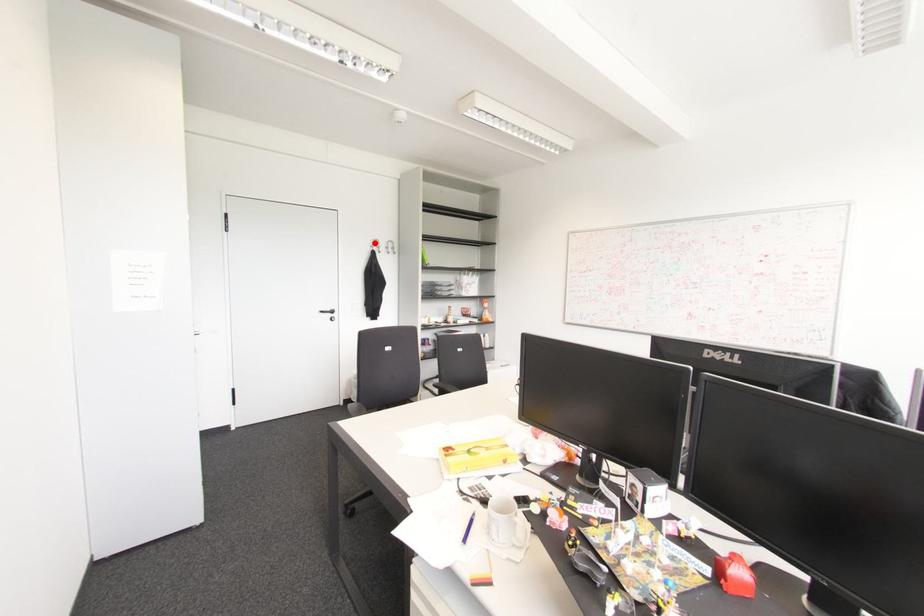
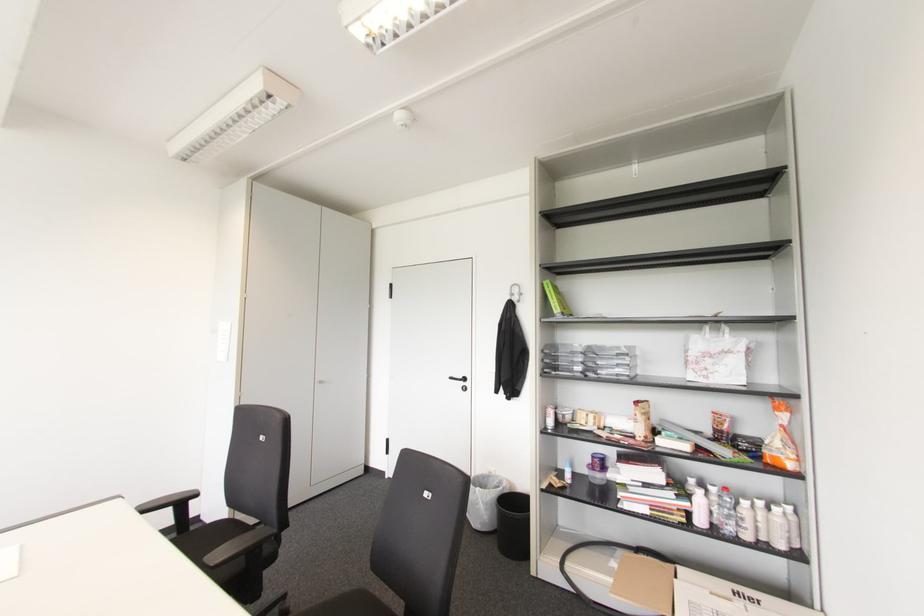
The point at the highlighted location is marked in the first image. Where is the corresponding point in the second image?

(516, 290)